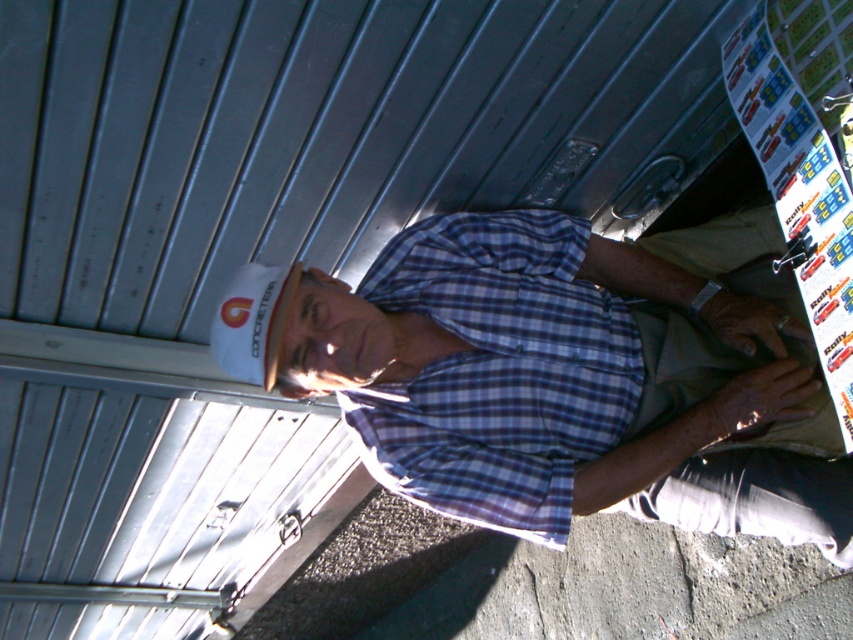
Describe the element at coordinates (558, 376) in the screenshot. I see `white hard hat at upper left` at that location.

How far apart are white hard hat at upper left and khaki fabric at lower right?

white hard hat at upper left and khaki fabric at lower right are 4.30 inches apart.

Locate an element on the screen. white hard hat at upper left is located at coordinates (558, 376).

You are a GUI agent. You are given a task and a screenshot of the screen. Output one action in this format:
    pyautogui.click(x=<x>, y=<y>)
    Task: Click on the white hard hat at upper left
    
    Given the screenshot: What is the action you would take?
    pyautogui.click(x=558, y=376)

Can you confirm if blue checkered shirt at center is positioned to the left of khaki fabric at lower right?

Indeed, blue checkered shirt at center is positioned on the left side of khaki fabric at lower right.

Does blue checkered shirt at center have a greater width compared to khaki fabric at lower right?

Yes, blue checkered shirt at center is wider than khaki fabric at lower right.

The image size is (853, 640). What are the coordinates of `blue checkered shirt at center` in the screenshot? It's located at (498, 371).

Can you confirm if white hard hat at upper left is smaller than blue checkered shirt at center?

No.

Who is more distant from viewer, (364, 387) or (444, 492)?

Positioned behind is point (364, 387).

Who is more distant from viewer, (354,316) or (532,536)?

The point (532,536) is more distant.

Find the location of a particular element. white hard hat at upper left is located at coordinates (558, 376).